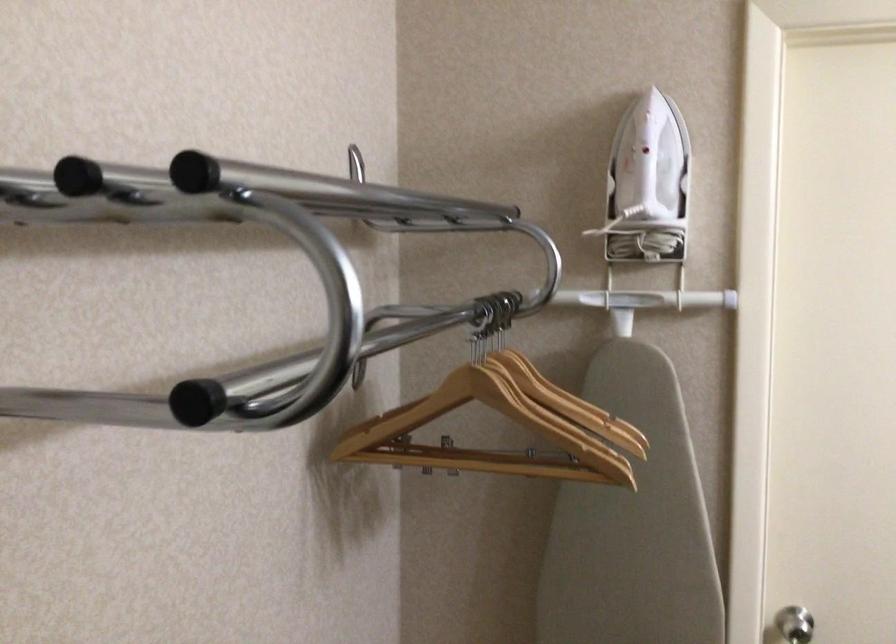
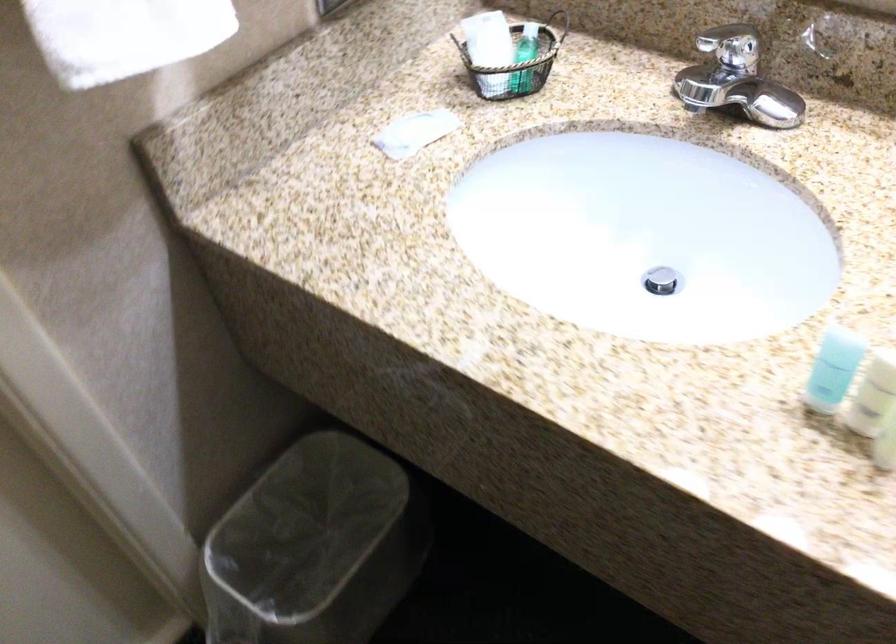
How did the camera likely rotate?

The camera's rotation is toward right-down.